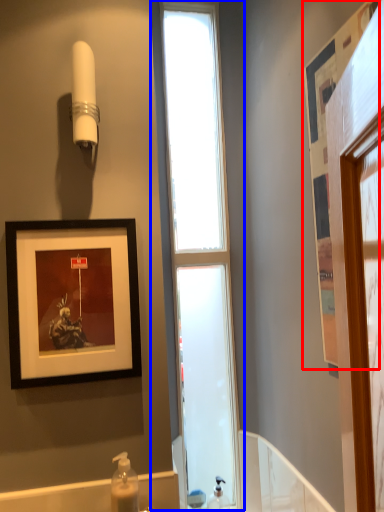
Question: Which point is further to the camera, picture frame (highlighted by a red box) or window (highlighted by a blue box)?

Choices:
 (A) picture frame
 (B) window

Answer: (B)